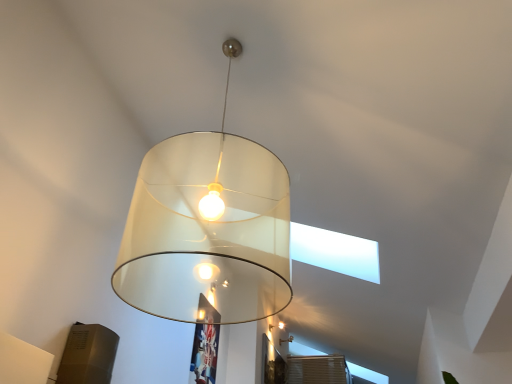
The width and height of the screenshot is (512, 384). Describe the element at coordinates (286, 340) in the screenshot. I see `translucent glass lampshade at center, which is the 1th lamp in back-to-front order` at that location.

In order to click on translucent glass lampshade at center, acting as the 2th lamp starting from the top in this screenshot , I will do `click(286, 340)`.

What is the approximate height of translucent white lampshade at center, the 1th lamp from the left?

The height of translucent white lampshade at center, the 1th lamp from the left, is 1.41 meters.

What do you see at coordinates (208, 229) in the screenshot?
I see `translucent white lampshade at center, the 1th lamp from the left` at bounding box center [208, 229].

Where is `translucent white lampshade at center, which is the second lamp from right to left`? This screenshot has width=512, height=384. translucent white lampshade at center, which is the second lamp from right to left is located at coordinates (208, 229).

Find the location of a particular element. This screenshot has height=384, width=512. translucent glass lampshade at center, marked as the 2th lamp in a left-to-right arrangement is located at coordinates (286, 340).

Can you confirm if translucent glass lampshade at center, marked as the 2th lamp in a left-to-right arrangement, is positioned to the right of translucent white lampshade at center, the 1th lamp viewed from the front?

Yes.

In the image, is translucent glass lampshade at center, positioned as the 2th lamp in front-to-back order, positioned in front of or behind translucent white lampshade at center, the 1th lamp from the top?

Visually, translucent glass lampshade at center, positioned as the 2th lamp in front-to-back order, is located behind translucent white lampshade at center, the 1th lamp from the top.

Which is closer to the camera, (282, 339) or (237, 252)?

The point (237, 252) is in front.

From the image's perspective, is translucent glass lampshade at center, which appears as the first lamp when ordered from the bottom, on top of translucent white lampshade at center, the second lamp from the back?

Incorrect, from the image's perspective, translucent glass lampshade at center, which appears as the first lamp when ordered from the bottom, is lower than translucent white lampshade at center, the second lamp from the back.

From a real-world perspective, who is located lower, translucent glass lampshade at center, which appears as the first lamp when ordered from the bottom, or translucent white lampshade at center, the 1th lamp from the left?

In real-world perspective, translucent white lampshade at center, the 1th lamp from the left, is lower.

Which of these two, translucent glass lampshade at center, which is the 1th lamp in back-to-front order, or translucent white lampshade at center, which is the second lamp in bottom-to-top order, is wider?

translucent white lampshade at center, which is the second lamp in bottom-to-top order.

Is translucent glass lampshade at center, which is the 1th lamp in back-to-front order, taller or shorter than translucent white lampshade at center, the 1th lamp from the left?

translucent glass lampshade at center, which is the 1th lamp in back-to-front order, is shorter than translucent white lampshade at center, the 1th lamp from the left.

Is translucent glass lampshade at center, acting as the 2th lamp starting from the top, smaller than translucent white lampshade at center, the 1th lamp from the left?

Correct, translucent glass lampshade at center, acting as the 2th lamp starting from the top, occupies less space than translucent white lampshade at center, the 1th lamp from the left.

Is translucent glass lampshade at center, positioned as the 2th lamp in front-to-back order, inside or outside of translucent white lampshade at center, the second lamp from the back?

translucent glass lampshade at center, positioned as the 2th lamp in front-to-back order, is spatially situated outside translucent white lampshade at center, the second lamp from the back.

Is translucent glass lampshade at center, which appears as the first lamp when ordered from the bottom, with translucent white lampshade at center, which is the second lamp from right to left?

No, translucent glass lampshade at center, which appears as the first lamp when ordered from the bottom, is not beside translucent white lampshade at center, which is the second lamp from right to left.

In the scene shown: Is translucent glass lampshade at center, marked as the 2th lamp in a left-to-right arrangement, facing away from translucent white lampshade at center, which is the second lamp in bottom-to-top order?

No.

In the scene shown: What's the angular difference between translucent glass lampshade at center, which appears as the first lamp when ordered from the bottom, and translucent white lampshade at center, which is the second lamp from right to left,'s facing directions?

The facing directions of translucent glass lampshade at center, which appears as the first lamp when ordered from the bottom, and translucent white lampshade at center, which is the second lamp from right to left, are 90.4 degrees apart.

How distant is translucent glass lampshade at center, which appears as the first lamp when ordered from the bottom, from translucent white lampshade at center, the second lamp from the back?

They are 4.54 meters apart.

This screenshot has height=384, width=512. I want to click on lamp on the right of translucent white lampshade at center, the second lamp from the back, so click(286, 340).

Is translucent white lampshade at center, the 1th lamp from the left, at the right side of translucent glass lampshade at center, which is the 1th lamp in back-to-front order?

In fact, translucent white lampshade at center, the 1th lamp from the left, is to the left of translucent glass lampshade at center, which is the 1th lamp in back-to-front order.

Which is in front, translucent white lampshade at center, which is the second lamp in bottom-to-top order, or translucent glass lampshade at center, the first lamp from the right?

translucent white lampshade at center, which is the second lamp in bottom-to-top order, is more forward.

Which is closer to the camera, (x=172, y=257) or (x=288, y=341)?

Point (x=172, y=257).

From the image's perspective, between translucent white lampshade at center, the 1th lamp from the left, and translucent glass lampshade at center, which appears as the first lamp when ordered from the bottom, which one is located above?

translucent white lampshade at center, the 1th lamp from the left, is shown above in the image.

From a real-world perspective, who is located higher, translucent white lampshade at center, the 1th lamp from the left, or translucent glass lampshade at center, acting as the 2th lamp starting from the top?

In real-world perspective, translucent glass lampshade at center, acting as the 2th lamp starting from the top, is above.

Can you confirm if translucent white lampshade at center, the second lamp from the back, is thinner than translucent glass lampshade at center, the first lamp from the right?

In fact, translucent white lampshade at center, the second lamp from the back, might be wider than translucent glass lampshade at center, the first lamp from the right.

Who is taller, translucent white lampshade at center, which is the second lamp in bottom-to-top order, or translucent glass lampshade at center, acting as the 2th lamp starting from the top?

With more height is translucent white lampshade at center, which is the second lamp in bottom-to-top order.

Who is smaller, translucent white lampshade at center, the second lamp from the back, or translucent glass lampshade at center, the first lamp from the right?

translucent glass lampshade at center, the first lamp from the right.

Is translucent white lampshade at center, which is the second lamp from right to left, completely or partially outside of translucent glass lampshade at center, which is the 1th lamp in back-to-front order?

Yes, translucent white lampshade at center, which is the second lamp from right to left, is outside of translucent glass lampshade at center, which is the 1th lamp in back-to-front order.

Is translucent white lampshade at center, the 1th lamp from the left, far from translucent glass lampshade at center, acting as the 2th lamp starting from the top?

Yes, translucent white lampshade at center, the 1th lamp from the left, and translucent glass lampshade at center, acting as the 2th lamp starting from the top, are located far from each other.

Is translucent glass lampshade at center, which is the 1th lamp in back-to-front order, at the back of translucent white lampshade at center, which is the second lamp in bottom-to-top order?

No, translucent glass lampshade at center, which is the 1th lamp in back-to-front order, is not at the back of translucent white lampshade at center, which is the second lamp in bottom-to-top order.

Could you measure the distance between translucent white lampshade at center, the 1th lamp viewed from the front, and translucent glass lampshade at center, marked as the 2th lamp in a left-to-right arrangement?

translucent white lampshade at center, the 1th lamp viewed from the front, is 4.54 meters away from translucent glass lampshade at center, marked as the 2th lamp in a left-to-right arrangement.

Locate an element on the screen. The width and height of the screenshot is (512, 384). lamp that appears below the translucent glass lampshade at center, which appears as the first lamp when ordered from the bottom (from a real-world perspective) is located at coordinates (208, 229).

I want to click on lamp above the translucent white lampshade at center, the 1th lamp viewed from the front (from a real-world perspective), so click(x=286, y=340).

The height and width of the screenshot is (384, 512). In order to click on lamp on the left of translucent glass lampshade at center, which is the 1th lamp in back-to-front order in this screenshot , I will do `click(208, 229)`.